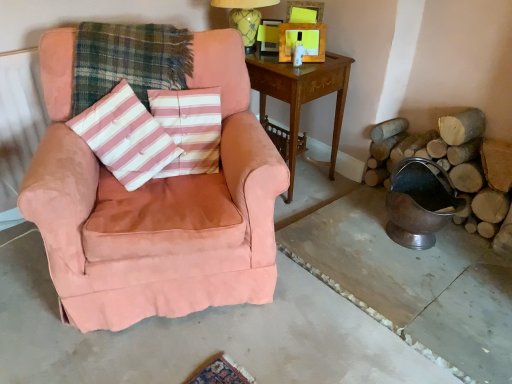
Question: Is natural wood logs at right situated inside yellow glazed ceramic table lamp at upper center or outside?

Choices:
 (A) outside
 (B) inside

Answer: (A)

Question: From the image's perspective, is natural wood logs at right positioned above or below yellow glazed ceramic table lamp at upper center?

Choices:
 (A) above
 (B) below

Answer: (B)

Question: Which of these objects is positioned farthest from the polished silver swivel chair at lower right?

Choices:
 (A) pink suede armchair at left
 (B) pink striped fabric pillow at center
 (C) pink striped fabric pillow at center
 (D) yellow matte picture frame at upper center
 (E) suede pink armchair at left

Answer: (C)

Question: Which of these objects is positioned farthest from the pink suede armchair at left?

Choices:
 (A) pink striped fabric pillow at center
 (B) yellow matte picture frame at upper center
 (C) plaid fabric at center
 (D) suede pink armchair at left
 (E) natural wood logs at right

Answer: (E)